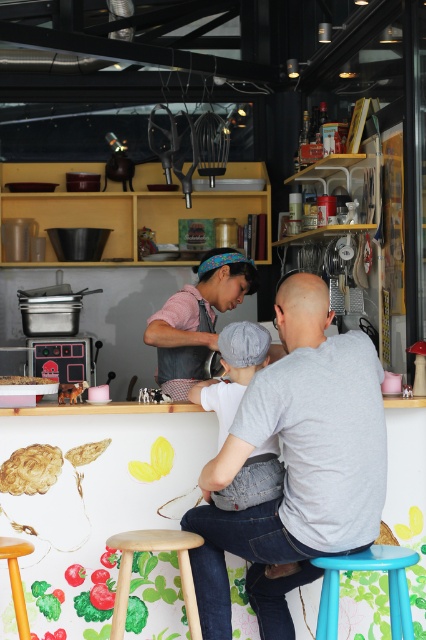
You are a customer in the cafe and want to place an order for a cake. The cafe has a denim baby carrier at center and a white glossy cake at center. Which item is larger in size?

The denim baby carrier at center is bigger than the white glossy cake at center, so the denim baby carrier at center is larger in size.

You are a customer in the cafe and want to ask the woman about the items at the center. Which item is closer to you, the pink fabric apron at center or the denim baby carrier at center?

The pink fabric apron at center is closer to you because the denim baby carrier at center is behind it.

You are a customer in the cafe and want to place an order for the white glossy cake at center. However, there is a denim baby carrier at center in the way. Can you reach the cake without moving the carrier?

The denim baby carrier at center is positioned under the white glossy cake at center, so you can reach the cake without moving the carrier because it is placed above it.